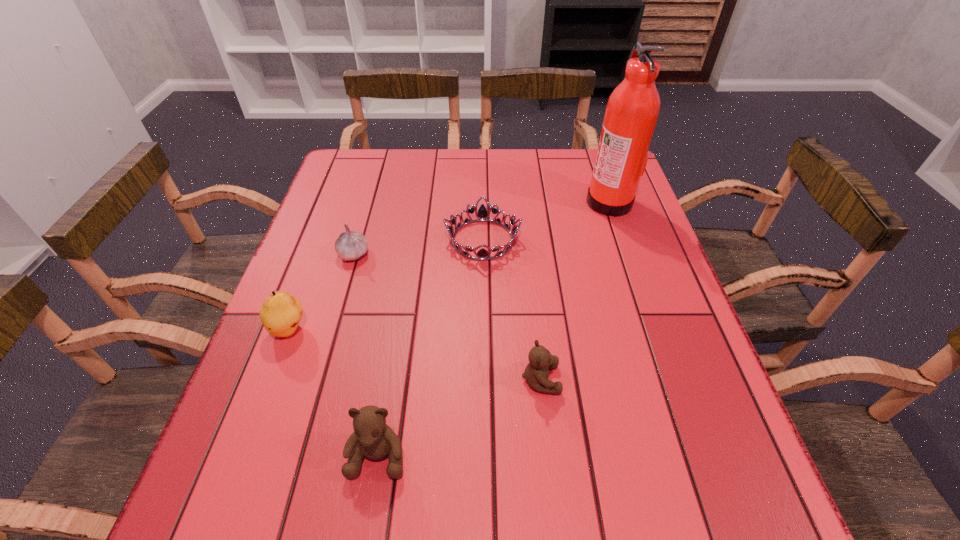
At what (x,y) coordinates should I click in order to perform the action: click on vacant space at the near left corner. Please return your answer as a coordinate pair (x, y). Looking at the image, I should click on (262, 418).

At what (x,y) coordinates should I click in order to perform the action: click on vacant space at the far right corner of the desktop. Please return your answer as a coordinate pair (x, y). Looking at the image, I should click on (582, 175).

Where is `unoccupied area between the tiara and the fire extinguisher`? The height and width of the screenshot is (540, 960). unoccupied area between the tiara and the fire extinguisher is located at coordinates (546, 220).

This screenshot has height=540, width=960. Find the location of `vacant space that is in between the pear and the garlic`. vacant space that is in between the pear and the garlic is located at coordinates (322, 291).

The height and width of the screenshot is (540, 960). Find the location of `vacant space in between the shortest object and the fifth object from right to left`. vacant space in between the shortest object and the fifth object from right to left is located at coordinates (419, 247).

This screenshot has height=540, width=960. I want to click on free space between the second nearest object and the tiara, so click(x=512, y=309).

Identify the location of vacant area between the nearer teddy bear and the shortest object. This screenshot has height=540, width=960. (430, 347).

You are a GUI agent. You are given a task and a screenshot of the screen. Output one action in this format:
    pyautogui.click(x=<x>, y=<y>)
    Task: Click on the vacant point located between the tiara and the fifth farthest object
    The height and width of the screenshot is (540, 960).
    Given the screenshot: What is the action you would take?
    pyautogui.click(x=512, y=309)

At what (x,y) coordinates should I click in order to perform the action: click on empty location between the fourth farthest object and the right teddy bear. Please return your answer as a coordinate pair (x, y). This screenshot has height=540, width=960. Looking at the image, I should click on (415, 354).

At what (x,y) coordinates should I click in order to perform the action: click on free space that is in between the pear and the tallest object. Please return your answer as a coordinate pair (x, y). Image resolution: width=960 pixels, height=540 pixels. Looking at the image, I should click on (449, 265).